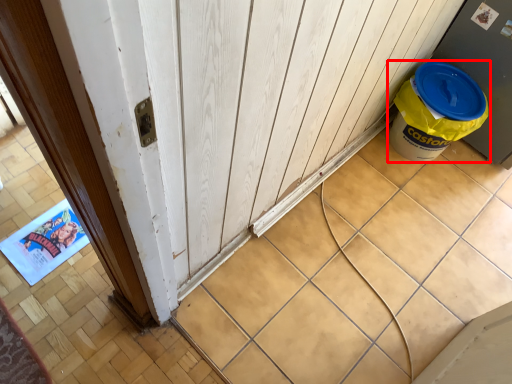
Question: Considering the relative positions of waste container (annotated by the red box) and barn door in the image provided, where is waste container (annotated by the red box) located with respect to the staircase?

Choices:
 (A) left
 (B) right

Answer: (B)